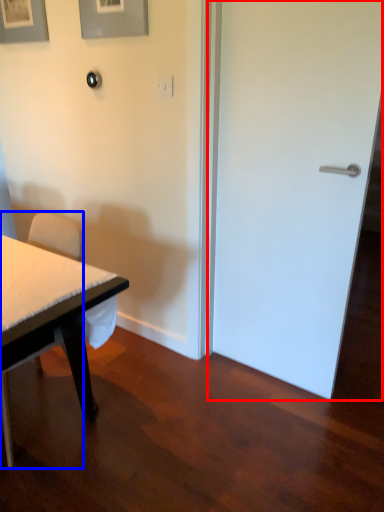
Question: Among these objects, which one is farthest to the camera, door (highlighted by a red box) or chair (highlighted by a blue box)?

Choices:
 (A) door
 (B) chair

Answer: (A)